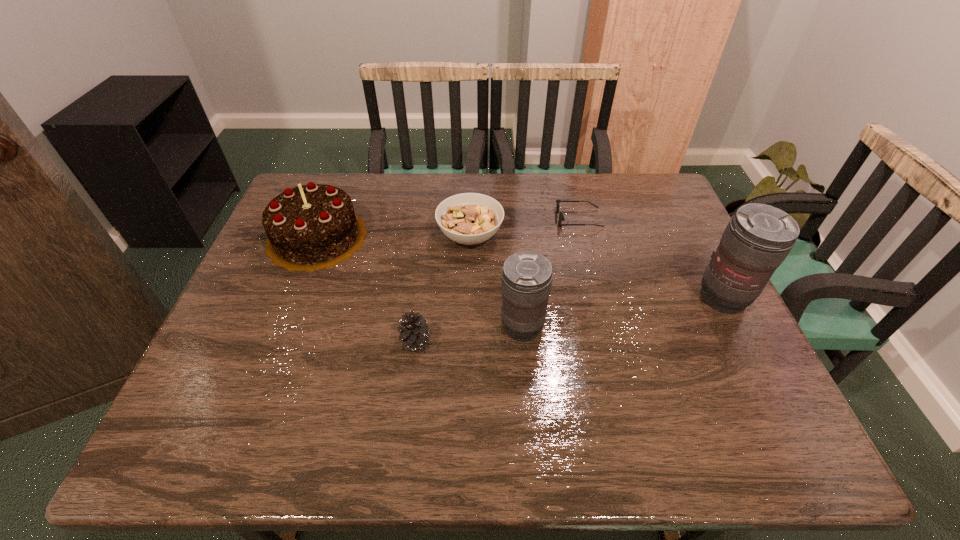
The width and height of the screenshot is (960, 540). In order to click on the third closest object to the pinecone in this screenshot , I will do `click(469, 218)`.